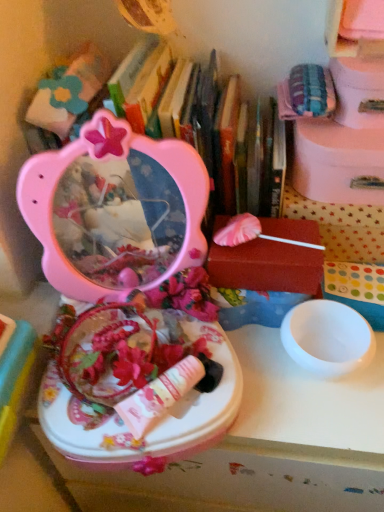
Question: Is point (122, 258) closer or farther from the camera than point (362, 256)?

Choices:
 (A) closer
 (B) farther

Answer: (A)

Question: In terms of size, does matte pink vanity at center appear bigger or smaller than white polka dot fabric at upper right, the second storage box when ordered from bottom to top?

Choices:
 (A) big
 (B) small

Answer: (B)

Question: Which object is the farthest from the pink matte lollipop at center, which ranks as the 4th storage box in top-to-bottom order?

Choices:
 (A) pink cardboard box at upper right, the 2th storage box viewed from the top
 (B) white glossy table at center
 (C) white glossy bowl at right
 (D) pink plastic mirror at upper left
 (E) pink plastic storage box at upper right, marked as the first storage box in a top-to-bottom arrangement

Answer: (B)

Question: Estimate the real-world distances between objects in this image. Which object is farther from the pink plastic storage box at upper right, marked as the first storage box in a top-to-bottom arrangement?

Choices:
 (A) pink cardboard box at upper right, acting as the 3th storage box starting from the bottom
 (B) pink plastic mirror at upper left
 (C) pink matte lollipop at center, which ranks as the first storage box in bottom-to-top order
 (D) white glossy table at center
 (E) white glossy bowl at right

Answer: (D)